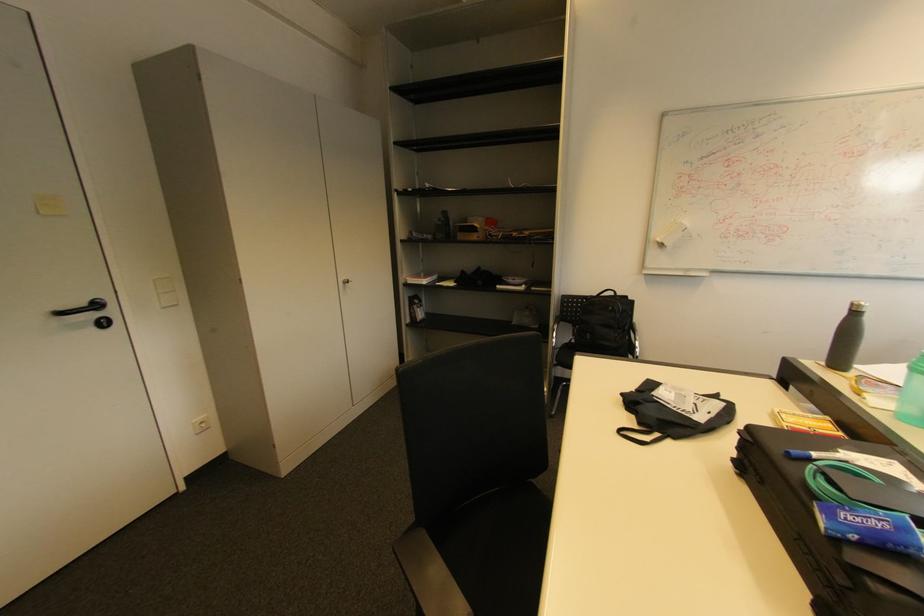
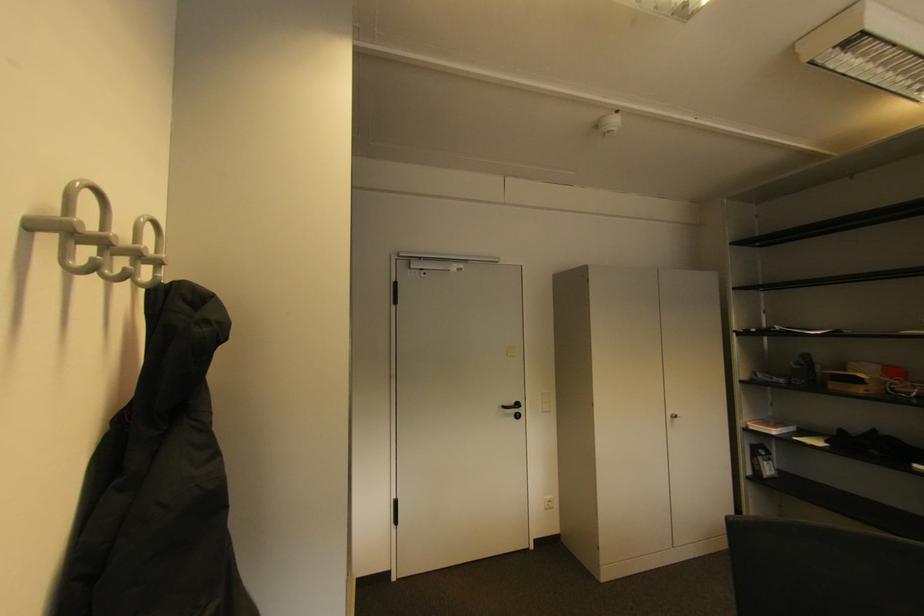
Question: The images are taken continuously from a first-person perspective. In which direction is your viewpoint rotating?

Choices:
 (A) Left
 (B) Right
 (C) Up
 (D) Down

Answer: (A)